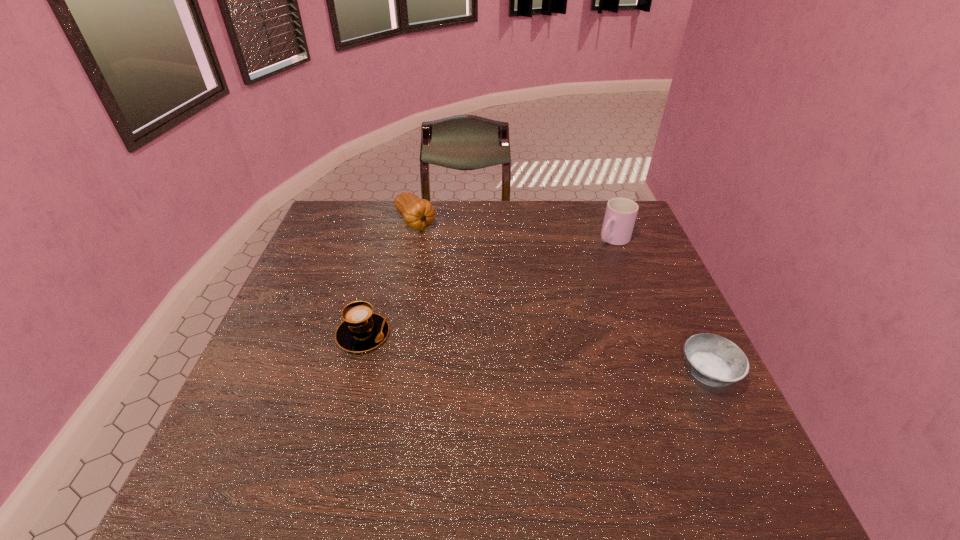
Locate an element on the screen. The width and height of the screenshot is (960, 540). free space on the desktop that is between the cappuccino and the shortest object and is positioned with the handle on the side of the cup is located at coordinates (482, 347).

You are a GUI agent. You are given a task and a screenshot of the screen. Output one action in this format:
    pyautogui.click(x=<x>, y=<y>)
    Task: Click on the free space on the desktop that is between the cappuccino and the shortest object and is positioned on the stem side of the gourd
    The height and width of the screenshot is (540, 960).
    Given the screenshot: What is the action you would take?
    pyautogui.click(x=531, y=353)